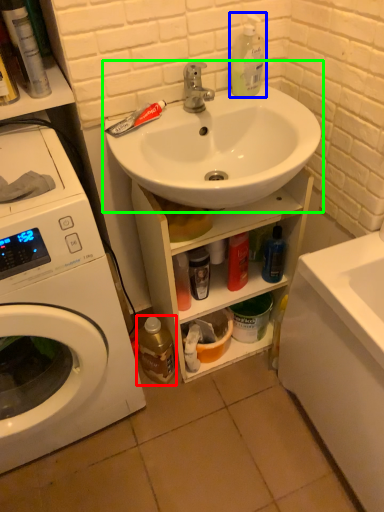
Question: Which object is positioned farthest from bottle (highlighted by a red box)? Select from cleaning product (highlighted by a blue box) and sink (highlighted by a green box).

Choices:
 (A) cleaning product
 (B) sink

Answer: (A)